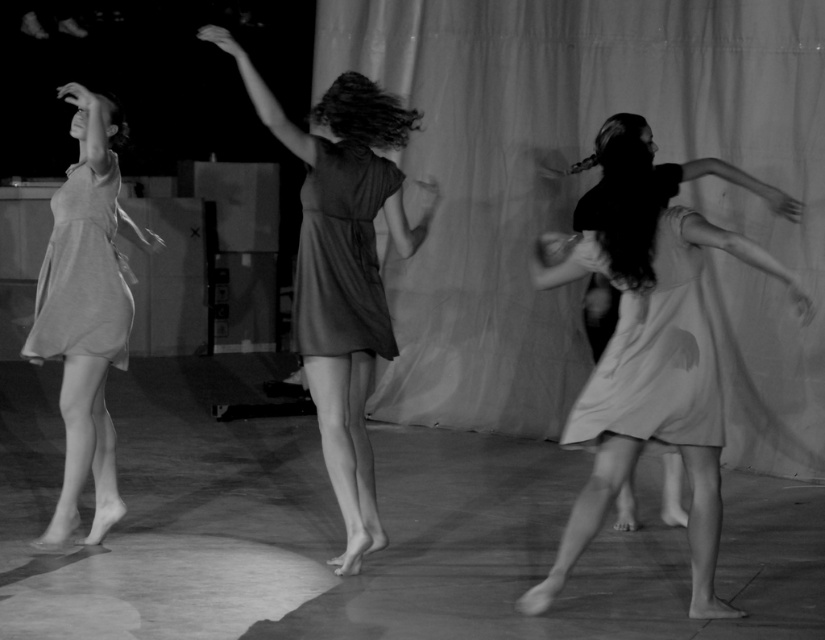
You are a photographer positioned at the back of the stage. You want to capture a clear photo of both the matte dark dress at center and the satin dress at center. Which dress should you focus on first to ensure both are in focus?

The matte dark dress at center is closer to the viewer than the satin dress at center, so you should focus on the matte dark dress at center first. By focusing on the closer object, the satin dress at center will also be in focus due to the depth of field.

You are a photographer standing in the center of the stage. You see the point at coordinates (86, 310). What object is located at that point?

The point at coordinates (86, 310) indicates the matte gray dress at left.

You are a photographer positioned at the back of the stage. You want to capture a photo of both the matte gray dress at left and the satin dress at center without any obstructions. Since you can only adjust your zoom, which dress should you focus on first to ensure both are in frame?

The matte gray dress at left is closer to the viewer than the satin dress at center. To ensure both are in frame, focus on the matte gray dress at left first, as it requires a wider angle to include both dresses due to its closer proximity.